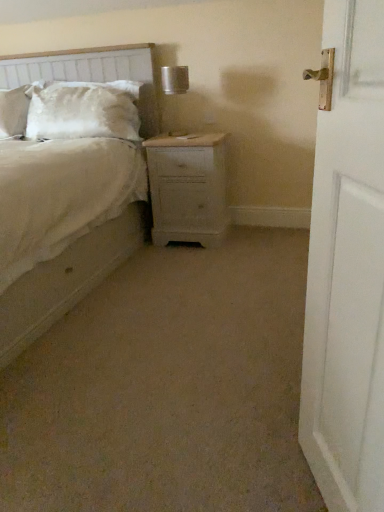
Question: Does textured fabric headboard at upper left contain light wood nightstand at center?

Choices:
 (A) no
 (B) yes

Answer: (A)

Question: From the image's perspective, is textured fabric headboard at upper left on light wood nightstand at center?

Choices:
 (A) no
 (B) yes

Answer: (B)

Question: Is textured fabric headboard at upper left turned away from light wood nightstand at center?

Choices:
 (A) yes
 (B) no

Answer: (B)

Question: Does textured fabric headboard at upper left have a larger size compared to light wood nightstand at center?

Choices:
 (A) yes
 (B) no

Answer: (A)

Question: Does textured fabric headboard at upper left have a greater height compared to light wood nightstand at center?

Choices:
 (A) yes
 (B) no

Answer: (A)

Question: Which is correct: white wooden door at right is inside textured fabric headboard at upper left, or outside of it?

Choices:
 (A) outside
 (B) inside

Answer: (A)

Question: Is white wooden door at right taller or shorter than textured fabric headboard at upper left?

Choices:
 (A) tall
 (B) short

Answer: (A)

Question: Considering the positions of point (349, 141) and point (77, 73), is point (349, 141) closer or farther from the camera than point (77, 73)?

Choices:
 (A) farther
 (B) closer

Answer: (B)

Question: From the image's perspective, is white wooden door at right above or below textured fabric headboard at upper left?

Choices:
 (A) below
 (B) above

Answer: (A)

Question: Is metallic silver table lamp at upper center inside the boundaries of satin white pillow at upper left, or outside?

Choices:
 (A) outside
 (B) inside

Answer: (A)

Question: Considering the positions of metallic silver table lamp at upper center and satin white pillow at upper left in the image, is metallic silver table lamp at upper center bigger or smaller than satin white pillow at upper left?

Choices:
 (A) small
 (B) big

Answer: (A)

Question: Considering the positions of point (168, 83) and point (66, 116), is point (168, 83) closer or farther from the camera than point (66, 116)?

Choices:
 (A) closer
 (B) farther

Answer: (B)

Question: From the image's perspective, is metallic silver table lamp at upper center positioned above or below satin white pillow at upper left?

Choices:
 (A) above
 (B) below

Answer: (B)

Question: Relative to beige fabric bed at center, is textured fabric headboard at upper left in front or behind?

Choices:
 (A) behind
 (B) front

Answer: (A)

Question: Considering the positions of textured fabric headboard at upper left and beige fabric bed at center in the image, is textured fabric headboard at upper left wider or thinner than beige fabric bed at center?

Choices:
 (A) wide
 (B) thin

Answer: (B)